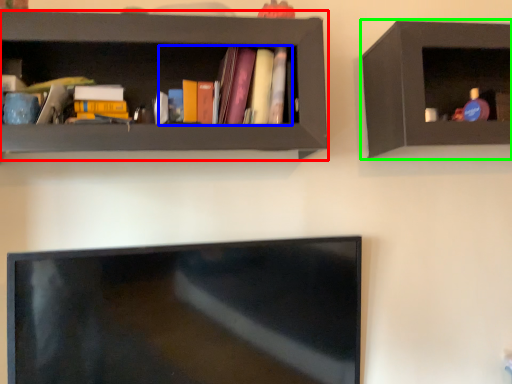
Question: Which object is positioned closest to shelf (highlighted by a red box)? Select from book (highlighted by a blue box) and shelf (highlighted by a green box).

Choices:
 (A) book
 (B) shelf

Answer: (A)